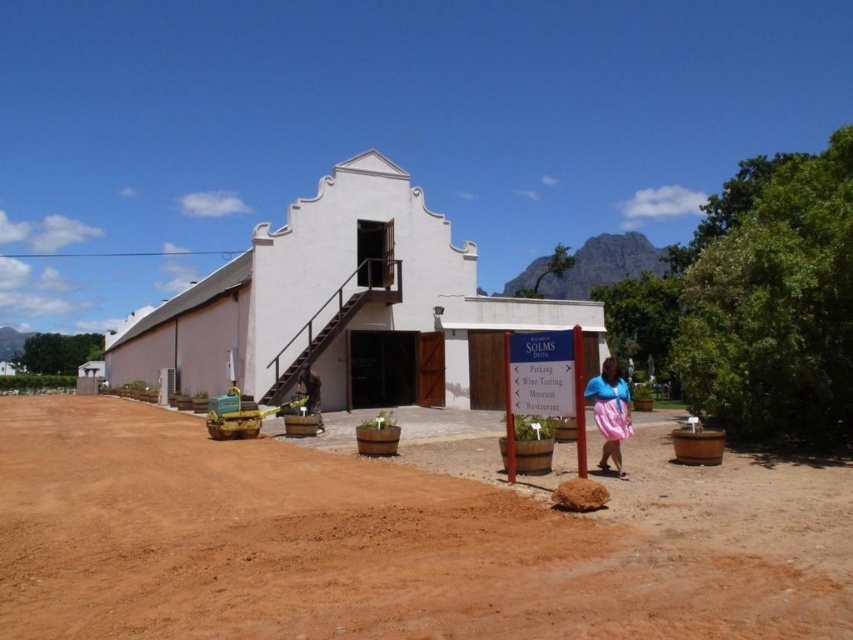
Question: Which object is farther from the camera taking this photo?

Choices:
 (A) pink satin skirt at lower right
 (B) white matte building at center

Answer: (B)

Question: From the image, what is the correct spatial relationship of brown dirt field at center in relation to white matte building at center?

Choices:
 (A) below
 (B) above

Answer: (A)

Question: Is white matte building at center to the left of pink satin skirt at lower right from the viewer's perspective?

Choices:
 (A) yes
 (B) no

Answer: (A)

Question: Estimate the real-world distances between objects in this image. Which object is closer to the yellow fabric bag at center?

Choices:
 (A) brown dirt field at center
 (B) white matte building at center
 (C) pink satin skirt at lower right

Answer: (A)

Question: Is brown dirt field at center positioned before pink satin skirt at lower right?

Choices:
 (A) yes
 (B) no

Answer: (A)

Question: Estimate the real-world distances between objects in this image. Which object is farther from the white matte building at center?

Choices:
 (A) yellow fabric bag at center
 (B) brown dirt field at center

Answer: (A)